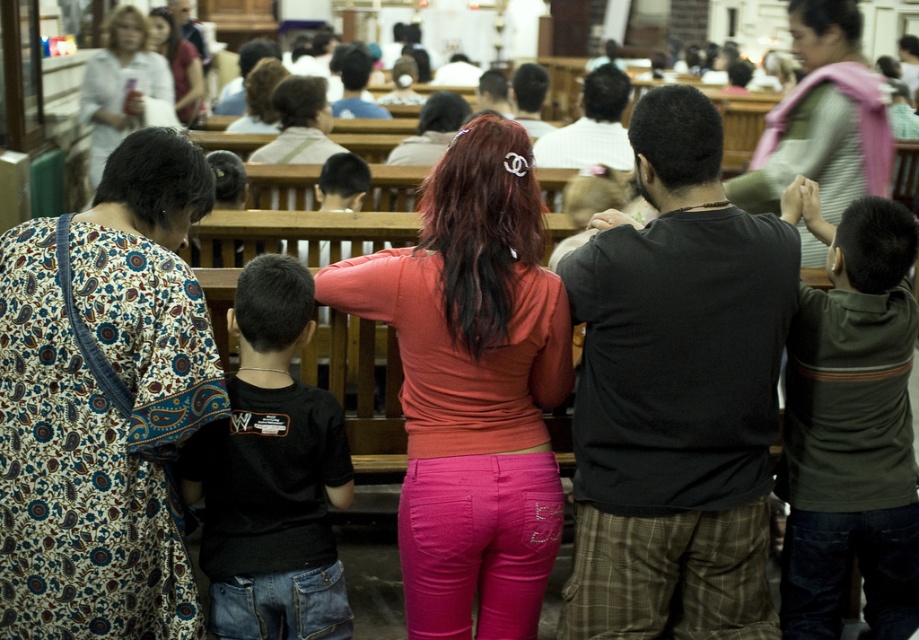
Question: Which of the following is the farthest from the observer?

Choices:
 (A) dark green hoodie at center
 (B) black cotton shirt at left

Answer: (A)

Question: Is matte orange shirt at center bigger than matte white shirt at upper left?

Choices:
 (A) no
 (B) yes

Answer: (A)

Question: Estimate the real-world distances between objects in this image. Which object is closer to the black cotton shirt at left?

Choices:
 (A) white cotton blouse at upper left
 (B) printed fabric dress at left
 (C) dark green hoodie at center

Answer: (B)

Question: Which point appears closest to the camera in this image?

Choices:
 (A) (302, 401)
 (B) (879, 157)

Answer: (A)

Question: Does dark green hoodie at center have a lesser width compared to white cotton blouse at upper left?

Choices:
 (A) yes
 (B) no

Answer: (A)

Question: Observing the image, what is the correct spatial positioning of dark green hoodie at center in reference to matte pink scarf at upper right?

Choices:
 (A) right
 (B) left

Answer: (B)